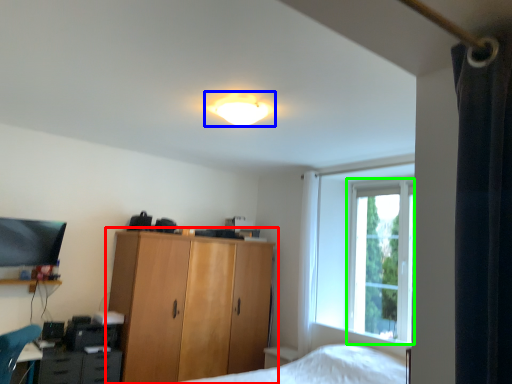
Question: Which object is positioned farthest from cupboard (highlighted by a red box)? Select from lamp (highlighted by a blue box) and window screen (highlighted by a green box).

Choices:
 (A) lamp
 (B) window screen

Answer: (A)